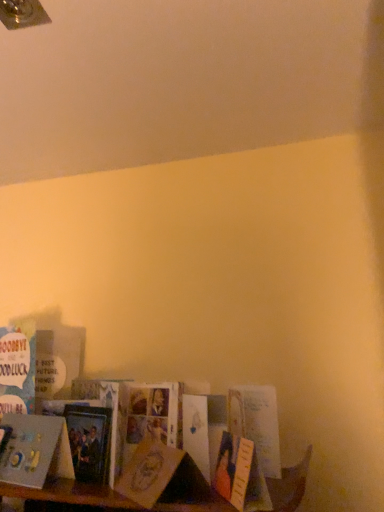
The height and width of the screenshot is (512, 384). Describe the element at coordinates (17, 369) in the screenshot. I see `blue paper card at lower left, which is the 2th book from front to back` at that location.

What do you see at coordinates (35, 450) in the screenshot?
I see `white matte card at lower left, positioned as the 2th book in back-to-front order` at bounding box center [35, 450].

Locate an element on the screen. This screenshot has height=512, width=384. white matte card at lower left, placed as the first book when sorted from front to back is located at coordinates (35, 450).

Find the location of a particular element. matte paper card at lower left, which is the first paperback book from front to back is located at coordinates (149, 472).

Where is `blue paper card at lower left, which is the first book from back to front`? This screenshot has height=512, width=384. blue paper card at lower left, which is the first book from back to front is located at coordinates (17, 369).

Where is `paperback book below the matte black book at lower left, which is the 2th paperback book from front to back (from a real-world perspective)`? paperback book below the matte black book at lower left, which is the 2th paperback book from front to back (from a real-world perspective) is located at coordinates (149, 472).

Which of these two, matte black book at lower left, which is the 2th paperback book from front to back, or matte paper card at lower left, which is the 1th paperback book from right to left, is thinner?

With smaller width is matte black book at lower left, which is the 2th paperback book from front to back.

Is the surface of matte black book at lower left, the 1th paperback book when ordered from back to front, in direct contact with matte paper card at lower left, which is the first paperback book from front to back?

They are not placed beside each other.

Is matte paper card at lower left, which ranks as the second paperback book in back-to-front order, at the back of matte black book at lower left, the 2th paperback book from the right?

matte black book at lower left, the 2th paperback book from the right, does not have its back to matte paper card at lower left, which ranks as the second paperback book in back-to-front order.

Between matte paper card at lower left, which ranks as the second paperback book in back-to-front order, and blue paper card at lower left, which is the first book from back to front, which one has less height?

matte paper card at lower left, which ranks as the second paperback book in back-to-front order.

Can you tell me how much matte paper card at lower left, which ranks as the second paperback book in back-to-front order, and blue paper card at lower left, which is the 2th book from front to back, differ in facing direction?

The facing directions of matte paper card at lower left, which ranks as the second paperback book in back-to-front order, and blue paper card at lower left, which is the 2th book from front to back, are 15 degrees apart.

Based on the photo, is matte paper card at lower left, which is the first paperback book from front to back, at the right side of blue paper card at lower left, which is the first book from back to front?

Yes.

Does point (143, 499) appear closer or farther from the camera than point (33, 379)?

Point (143, 499).

Does matte paper card at lower left, which is the first paperback book from front to back, appear on the right side of white matte card at lower left, placed as the first book when sorted from front to back?

Yes, matte paper card at lower left, which is the first paperback book from front to back, is to the right of white matte card at lower left, placed as the first book when sorted from front to back.

From the image's perspective, is matte paper card at lower left, which is the first paperback book from front to back, above or below white matte card at lower left, positioned as the 2th book in back-to-front order?

Clearly, from the image's perspective, matte paper card at lower left, which is the first paperback book from front to back, is above white matte card at lower left, positioned as the 2th book in back-to-front order.

The height and width of the screenshot is (512, 384). What are the coordinates of `paperback book that is the 2nd object to the right of the white matte card at lower left, positioned as the 2th book in back-to-front order, starting at the anchor` in the screenshot? It's located at (149, 472).

From a real-world perspective, is blue paper card at lower left, which is the first book from back to front, on matte black book at lower left, arranged as the first paperback book when viewed from the left?

Yes, from a real-world perspective, blue paper card at lower left, which is the first book from back to front, is on top of matte black book at lower left, arranged as the first paperback book when viewed from the left.

Is blue paper card at lower left, which is the 2th book from front to back, to the left of matte black book at lower left, arranged as the first paperback book when viewed from the left, from the viewer's perspective?

Correct, you'll find blue paper card at lower left, which is the 2th book from front to back, to the left of matte black book at lower left, arranged as the first paperback book when viewed from the left.

Identify the location of the 1st paperback book in front of the blue paper card at lower left, which is the 2th book from front to back. tap(89, 441).

Which of these two, white matte card at lower left, placed as the first book when sorted from front to back, or blue paper card at lower left, which is the 2th book from front to back, stands taller?

blue paper card at lower left, which is the 2th book from front to back, is taller.

From a real-world perspective, who is located higher, white matte card at lower left, placed as the first book when sorted from front to back, or blue paper card at lower left, which is the 2th book from front to back?

blue paper card at lower left, which is the 2th book from front to back, from a real-world perspective.

Is white matte card at lower left, positioned as the 2th book in back-to-front order, positioned with its back to blue paper card at lower left, which is the 2th book from front to back?

No, white matte card at lower left, positioned as the 2th book in back-to-front order, is not facing the opposite direction of blue paper card at lower left, which is the 2th book from front to back.

From the picture: Is white matte card at lower left, positioned as the 2th book in back-to-front order, next to blue paper card at lower left, which is the 2th book from front to back, and touching it?

No, white matte card at lower left, positioned as the 2th book in back-to-front order, is not in contact with blue paper card at lower left, which is the 2th book from front to back.

Which object is more forward, white matte card at lower left, placed as the first book when sorted from front to back, or matte paper card at lower left, marked as the 2th paperback book in a left-to-right arrangement?

matte paper card at lower left, marked as the 2th paperback book in a left-to-right arrangement, is more forward.

Is matte paper card at lower left, which ranks as the second paperback book in back-to-front order, completely or partially inside white matte card at lower left, placed as the first book when sorted from front to back?

No, matte paper card at lower left, which ranks as the second paperback book in back-to-front order, is located outside of white matte card at lower left, placed as the first book when sorted from front to back.

Is white matte card at lower left, positioned as the 2th book in back-to-front order, bigger than matte paper card at lower left, which is the 1th paperback book from right to left?

Correct, white matte card at lower left, positioned as the 2th book in back-to-front order, is larger in size than matte paper card at lower left, which is the 1th paperback book from right to left.

From the image's perspective, is white matte card at lower left, placed as the first book when sorted from front to back, located above or below matte paper card at lower left, which is the first paperback book from front to back?

From the image's perspective, white matte card at lower left, placed as the first book when sorted from front to back, appears below matte paper card at lower left, which is the first paperback book from front to back.

Does blue paper card at lower left, which is the 2th book from front to back, have a larger size compared to matte paper card at lower left, which is the first paperback book from front to back?

Yes, blue paper card at lower left, which is the 2th book from front to back, is bigger than matte paper card at lower left, which is the first paperback book from front to back.

Is blue paper card at lower left, which is the first book from back to front, to the right of matte paper card at lower left, which ranks as the second paperback book in back-to-front order, from the viewer's perspective?

Incorrect, blue paper card at lower left, which is the first book from back to front, is not on the right side of matte paper card at lower left, which ranks as the second paperback book in back-to-front order.

From the image's perspective, is blue paper card at lower left, which is the 2th book from front to back, below matte paper card at lower left, marked as the 2th paperback book in a left-to-right arrangement?

No, from the image's perspective, blue paper card at lower left, which is the 2th book from front to back, is not below matte paper card at lower left, marked as the 2th paperback book in a left-to-right arrangement.

Is blue paper card at lower left, which is the first book from back to front, beside matte paper card at lower left, which is the 1th paperback book from right to left?

blue paper card at lower left, which is the first book from back to front, is not next to matte paper card at lower left, which is the 1th paperback book from right to left, and they're not touching.

I want to click on paperback book above the matte paper card at lower left, which is the first paperback book from front to back (from a real-world perspective), so click(89, 441).

From a real-world perspective, which paperback book is the 2nd one underneath the blue paper card at lower left, which is the first book from back to front? Please provide its 2D coordinates.

[(149, 472)]

Considering their positions, is white matte card at lower left, positioned as the 2th book in back-to-front order, positioned closer to matte paper card at lower left, which ranks as the second paperback book in back-to-front order, than matte black book at lower left, the 2th paperback book from the right?

matte black book at lower left, the 2th paperback book from the right, is positioned closer to the anchor matte paper card at lower left, which ranks as the second paperback book in back-to-front order.

From the image, which object appears to be nearer to matte black book at lower left, the 1th paperback book when ordered from back to front, blue paper card at lower left, which is the 2th book from front to back, or matte paper card at lower left, which is the first paperback book from front to back?

matte paper card at lower left, which is the first paperback book from front to back, is positioned closer to the anchor matte black book at lower left, the 1th paperback book when ordered from back to front.

Based on their spatial positions, is blue paper card at lower left, which is the 2th book from front to back, or matte paper card at lower left, which ranks as the second paperback book in back-to-front order, further from white matte card at lower left, positioned as the 2th book in back-to-front order?

matte paper card at lower left, which ranks as the second paperback book in back-to-front order, is further to white matte card at lower left, positioned as the 2th book in back-to-front order.

Looking at the image, which one is located closer to blue paper card at lower left, which is the 2th book from front to back, matte paper card at lower left, which is the 1th paperback book from right to left, or matte black book at lower left, which is the 2th paperback book from front to back?

matte black book at lower left, which is the 2th paperback book from front to back, lies closer to blue paper card at lower left, which is the 2th book from front to back, than the other object.

When comparing their distances from matte paper card at lower left, which ranks as the second paperback book in back-to-front order, does blue paper card at lower left, which is the 2th book from front to back, or matte black book at lower left, the 2th paperback book from the right, seem further?

Based on the image, blue paper card at lower left, which is the 2th book from front to back, appears to be further to matte paper card at lower left, which ranks as the second paperback book in back-to-front order.

From the image, which object appears to be nearer to blue paper card at lower left, which is the 2th book from front to back, matte black book at lower left, the 2th paperback book from the right, or matte paper card at lower left, marked as the 2th paperback book in a left-to-right arrangement?

The object closer to blue paper card at lower left, which is the 2th book from front to back, is matte black book at lower left, the 2th paperback book from the right.

Estimate the real-world distances between objects in this image. Which object is further from white matte card at lower left, positioned as the 2th book in back-to-front order, matte paper card at lower left, which ranks as the second paperback book in back-to-front order, or blue paper card at lower left, which is the first book from back to front?

Based on the image, matte paper card at lower left, which ranks as the second paperback book in back-to-front order, appears to be further to white matte card at lower left, positioned as the 2th book in back-to-front order.

Which object lies nearer to the anchor point blue paper card at lower left, which is the first book from back to front, matte black book at lower left, which is the 2th paperback book from front to back, or white matte card at lower left, positioned as the 2th book in back-to-front order?

white matte card at lower left, positioned as the 2th book in back-to-front order, is closer to blue paper card at lower left, which is the first book from back to front.

Where is `book between blue paper card at lower left, which is the first book from back to front, and matte black book at lower left, arranged as the first paperback book when viewed from the left, in the horizontal direction`? The image size is (384, 512). book between blue paper card at lower left, which is the first book from back to front, and matte black book at lower left, arranged as the first paperback book when viewed from the left, in the horizontal direction is located at coordinates (35, 450).

The height and width of the screenshot is (512, 384). I want to click on book between blue paper card at lower left, which is the 2th book from front to back, and matte paper card at lower left, which is the first paperback book from front to back, in the horizontal direction, so click(x=35, y=450).

Where is `paperback book located between white matte card at lower left, positioned as the 2th book in back-to-front order, and matte paper card at lower left, marked as the 2th paperback book in a left-to-right arrangement, in the left-right direction`? This screenshot has width=384, height=512. paperback book located between white matte card at lower left, positioned as the 2th book in back-to-front order, and matte paper card at lower left, marked as the 2th paperback book in a left-to-right arrangement, in the left-right direction is located at coordinates (89, 441).

Where is `paperback book situated between blue paper card at lower left, which is the 2th book from front to back, and matte paper card at lower left, which is the 1th paperback book from right to left, from left to right`? This screenshot has height=512, width=384. paperback book situated between blue paper card at lower left, which is the 2th book from front to back, and matte paper card at lower left, which is the 1th paperback book from right to left, from left to right is located at coordinates (89, 441).